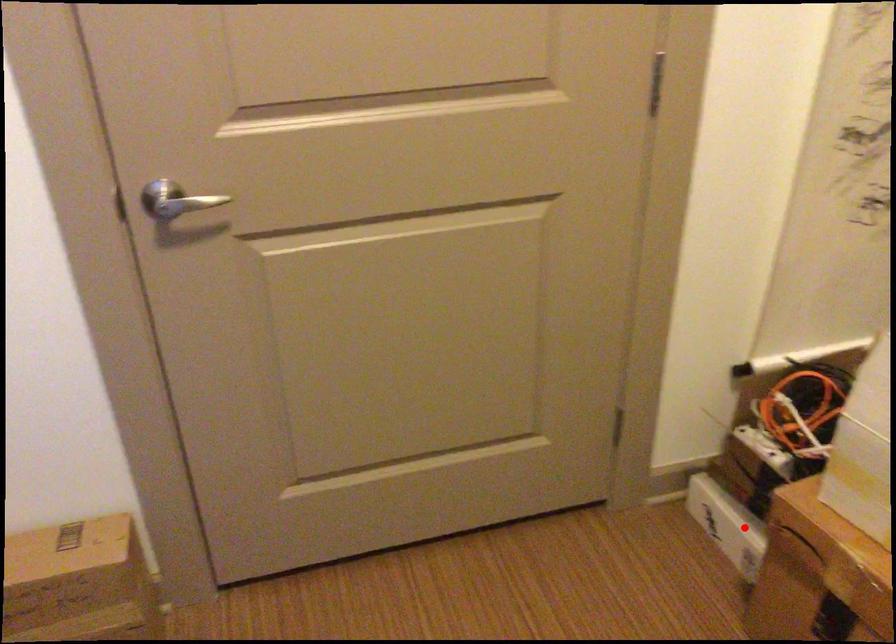
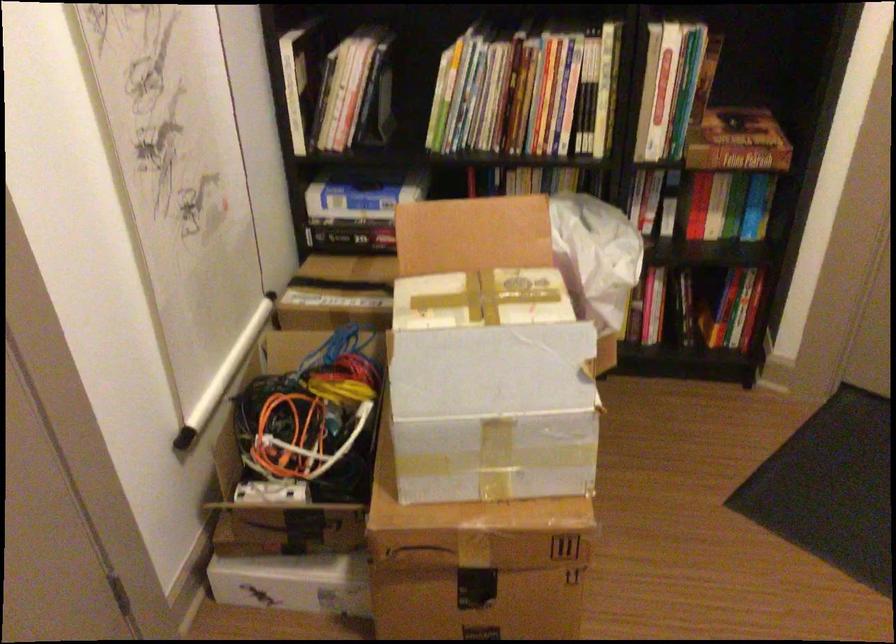
The point at the highlighted location is marked in the first image. Where is the corresponding point in the second image?

(293, 583)